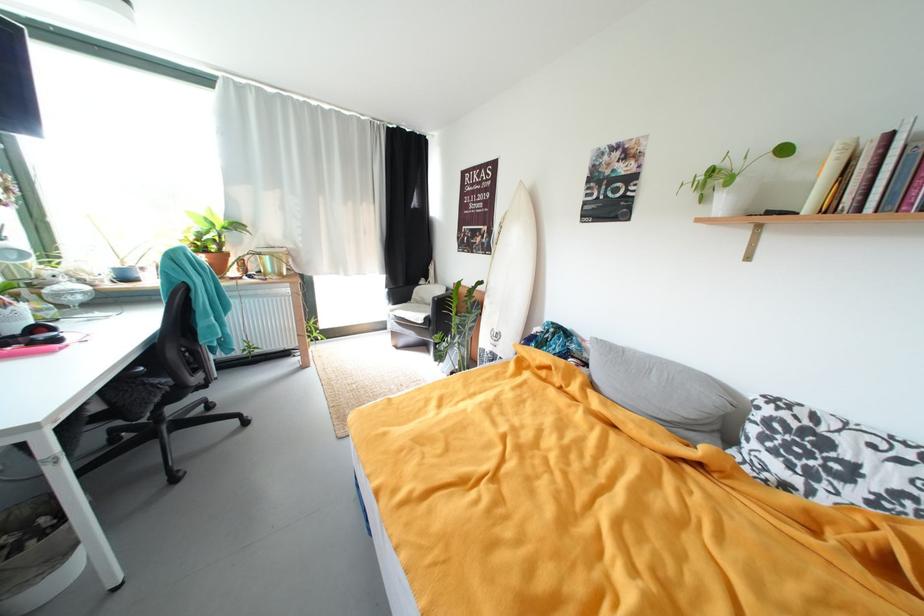
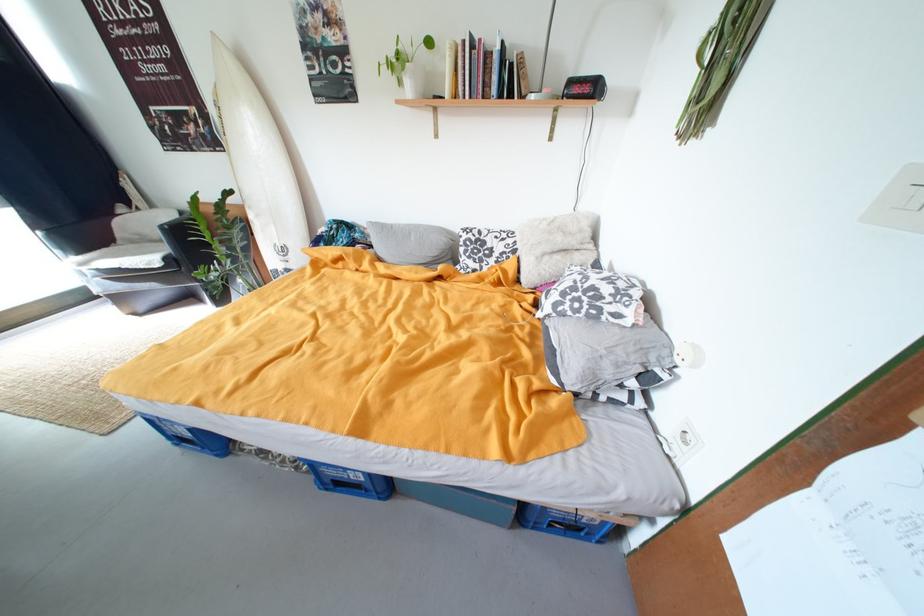
The point at (588,347) is marked in the first image. Where is the corresponding point in the second image?

(371, 235)